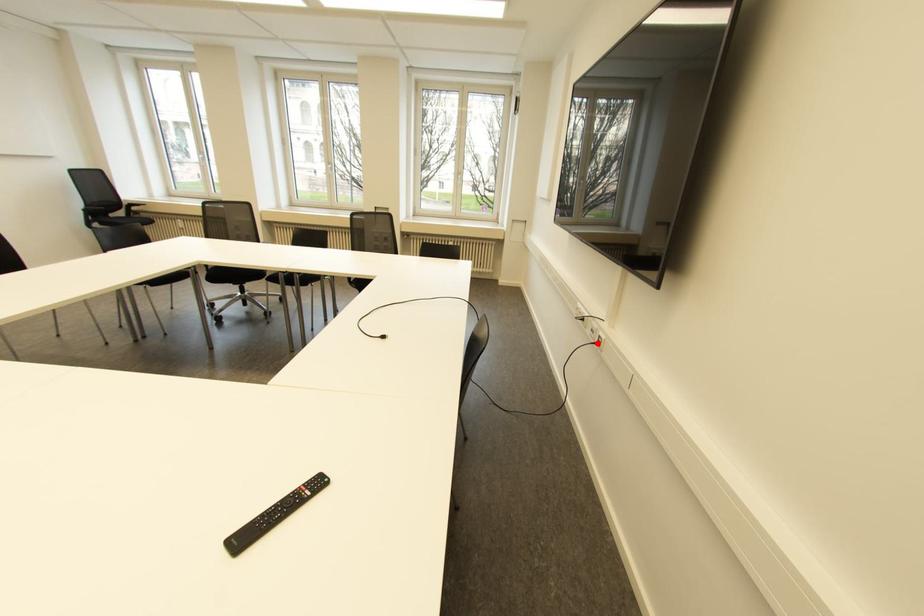
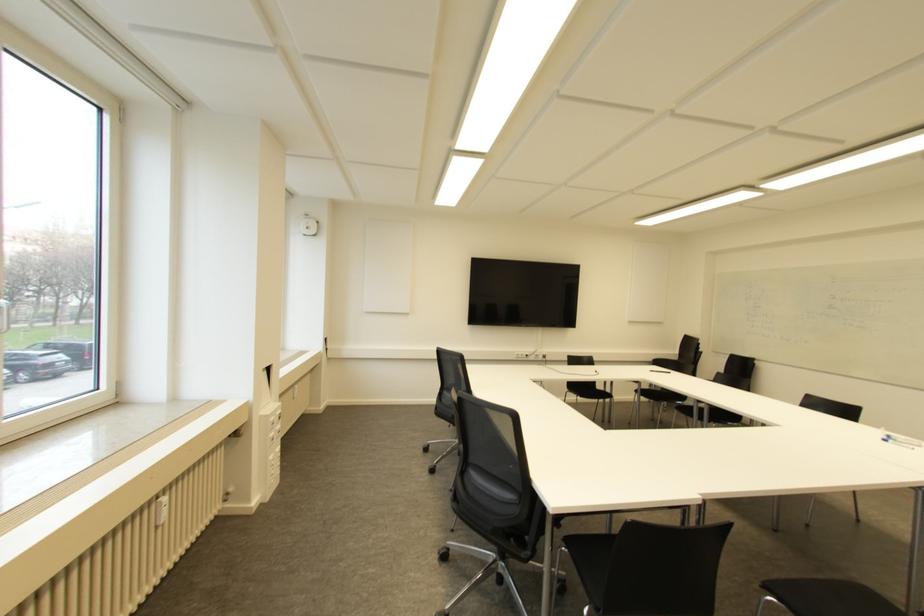
Locate, in the second image, the point that corresponds to the highlighted location in the first image.

(543, 355)